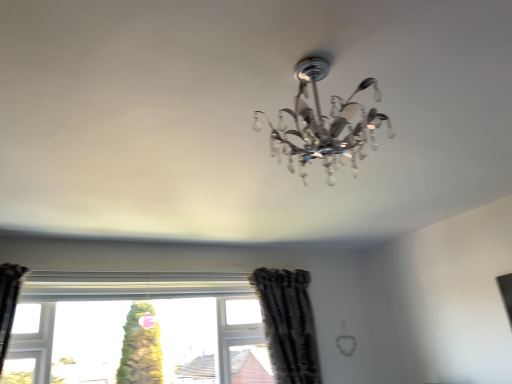
What do you see at coordinates (288, 324) in the screenshot? This screenshot has width=512, height=384. I see `black textured curtain at lower center` at bounding box center [288, 324].

Locate an element on the screen. The image size is (512, 384). black textured curtain at lower center is located at coordinates (288, 324).

Describe the element at coordinates (139, 334) in the screenshot. This screenshot has height=384, width=512. I see `clear glass window at center` at that location.

I want to click on clear glass window at center, so click(139, 334).

The width and height of the screenshot is (512, 384). I want to click on black textured curtain at lower center, so click(x=288, y=324).

Does clear glass window at center appear on the left side of black textured curtain at lower center?

Yes, clear glass window at center is to the left of black textured curtain at lower center.

Is the position of clear glass window at center less distant than that of black textured curtain at lower center?

Yes, clear glass window at center is closer to the camera.

Is point (85, 307) closer to camera compared to point (291, 383)?

Yes.

From the image's perspective, is clear glass window at center located above or below black textured curtain at lower center?

From the image's perspective, clear glass window at center appears below black textured curtain at lower center.

From a real-world perspective, who is located lower, clear glass window at center or black textured curtain at lower center?

In real-world perspective, clear glass window at center is lower.

Considering the sizes of objects clear glass window at center and black textured curtain at lower center in the image provided, who is thinner, clear glass window at center or black textured curtain at lower center?

Thinner between the two is clear glass window at center.

Considering the sizes of clear glass window at center and black textured curtain at lower center in the image, is clear glass window at center taller or shorter than black textured curtain at lower center?

In the image, clear glass window at center appears to be shorter than black textured curtain at lower center.

Is clear glass window at center smaller than black textured curtain at lower center?

No.

Is clear glass window at center situated inside black textured curtain at lower center or outside?

clear glass window at center is not enclosed by black textured curtain at lower center.

From the picture: Are clear glass window at center and black textured curtain at lower center making contact?

No.

Is clear glass window at center looking in the opposite direction of black textured curtain at lower center?

clear glass window at center is not turned away from black textured curtain at lower center.

What's the angular difference between clear glass window at center and black textured curtain at lower center's facing directions?

The angle between the facing direction of clear glass window at center and the facing direction of black textured curtain at lower center is 0.00103 degrees.

Identify the location of window below the black textured curtain at lower center (from the image's perspective). The width and height of the screenshot is (512, 384). (139, 334).

Which is more to the left, black textured curtain at lower center or clear glass window at center?

Positioned to the left is clear glass window at center.

Is black textured curtain at lower center positioned behind clear glass window at center?

Yes, black textured curtain at lower center is further from the viewer.

Does point (272, 301) come behind point (147, 295)?

Yes, it is.

From the image's perspective, who appears lower, black textured curtain at lower center or clear glass window at center?

From the image's view, clear glass window at center is below.

From a real-world perspective, is black textured curtain at lower center physically located above or below clear glass window at center?

black textured curtain at lower center is situated higher than clear glass window at center in the real world.

Considering the relative sizes of black textured curtain at lower center and clear glass window at center in the image provided, is black textured curtain at lower center wider than clear glass window at center?

Yes.

In terms of height, does black textured curtain at lower center look taller or shorter compared to clear glass window at center?

Considering their sizes, black textured curtain at lower center has more height than clear glass window at center.

Can you confirm if black textured curtain at lower center is bigger than clear glass window at center?

No.

Consider the image. Would you say black textured curtain at lower center is inside or outside clear glass window at center?

black textured curtain at lower center is spatially situated outside clear glass window at center.

Is black textured curtain at lower center not close to clear glass window at center?

That's not correct — black textured curtain at lower center is a little close to clear glass window at center.

Is black textured curtain at lower center positioned with its back to clear glass window at center?

black textured curtain at lower center does not have its back to clear glass window at center.

Find the location of a particular element. window below the black textured curtain at lower center (from a real-world perspective) is located at coordinates (139, 334).

Identify the location of window directly beneath the black textured curtain at lower center (from a real-world perspective). pyautogui.click(x=139, y=334).

The image size is (512, 384). I want to click on curtain behind the clear glass window at center, so click(x=288, y=324).